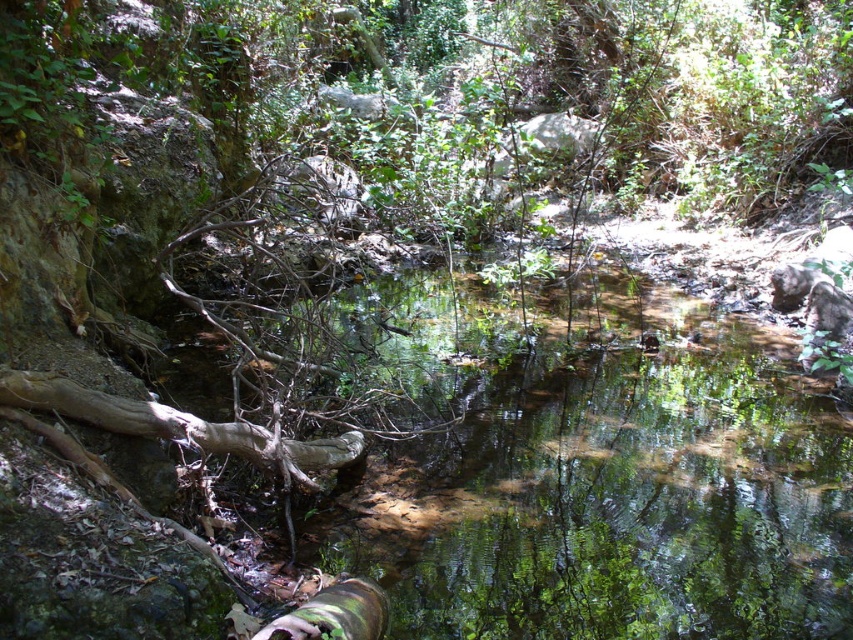
You are standing at the edge of the stream and want to cross to the other side. The clear water at center is in your way. Can you step over it without getting your feet wet?

The clear water at center is located at point (601,474), which indicates its position in the scene. Since the stream is shallow and the water is calm, you can likely step over it without getting your feet wet by carefully placing your foot on the nearby rocks or the fallen tree trunk mentioned in the scene description.

Where is the clear water at center located in the image?

The clear water at center is located at point (601, 474).

You are a hiker carrying a heavy backpack and need to cross the stream. You see the clear water at center and the green mossy log at center. Which object is closer to you if you are standing on the rocky outcrop on the left side of the stream?

The green mossy log at center is closer to you than the clear water at center since they are 4.38 feet apart.